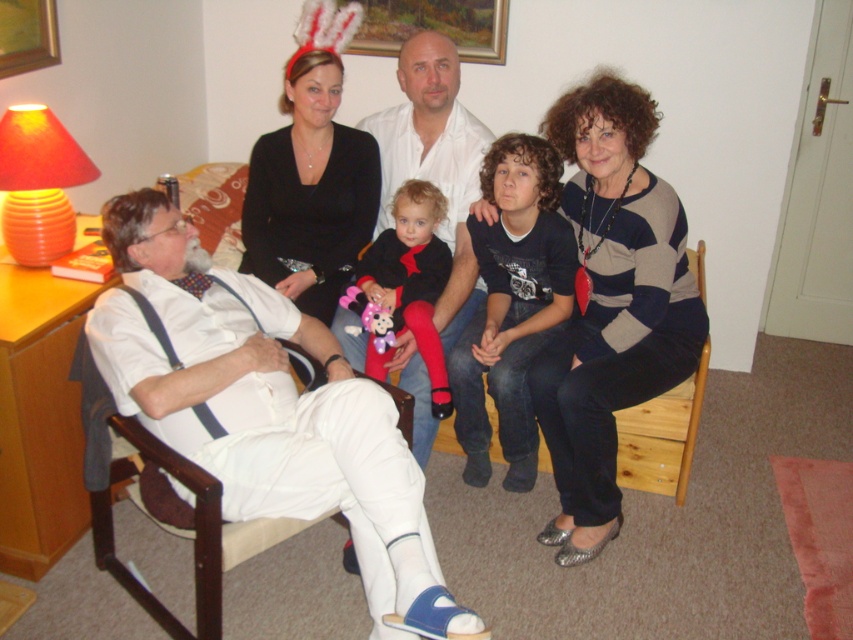
You are standing in the living room and want to find the dark blue cotton shirt at center. According to the coordinates provided, where should you look?

The dark blue cotton shirt at center is located at coordinates point (512,305).